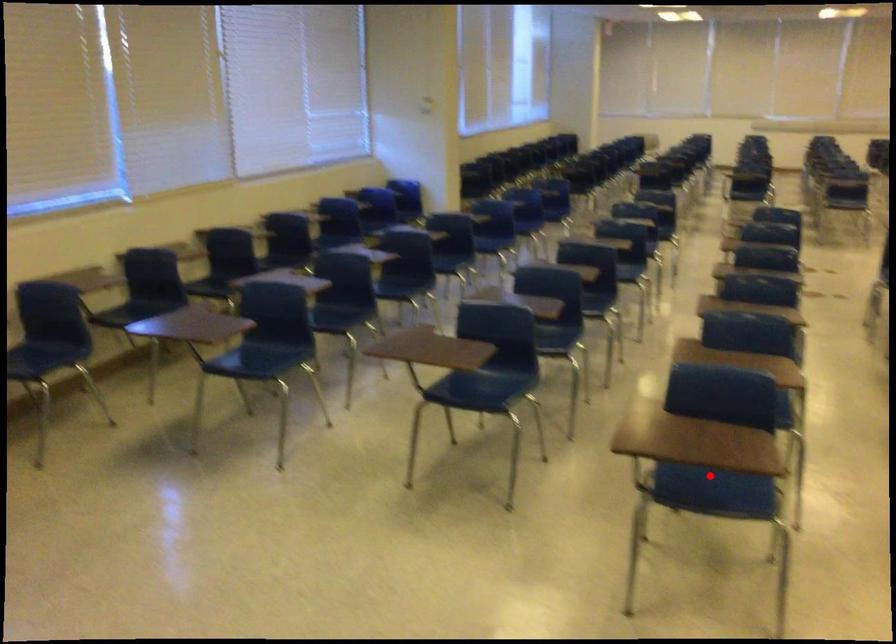
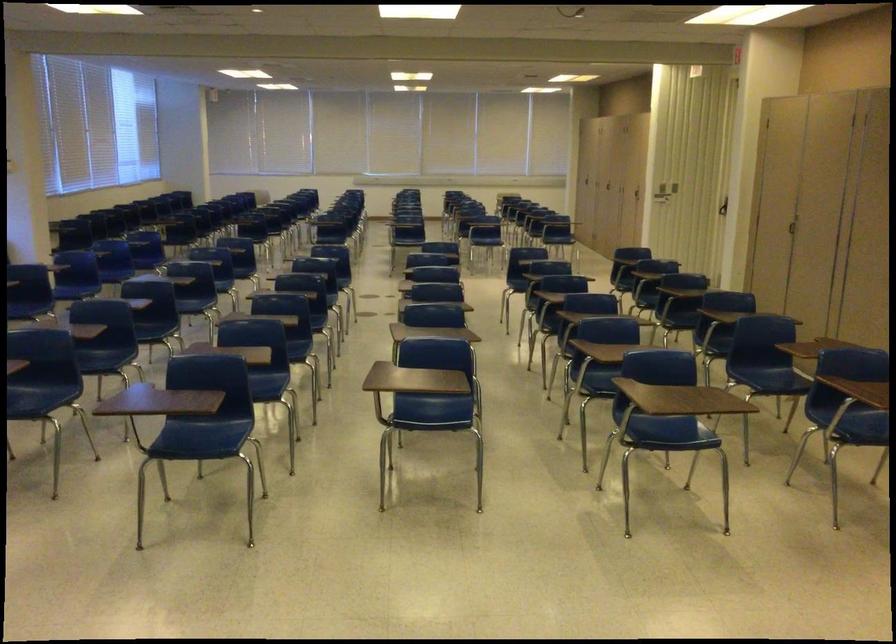
Question: I am providing you with two images of the same scene from different viewpoints. Given a red point in image1, look at the same physical point in image2. Is it:

Choices:
 (A) Closer to the viewpoint
 (B) Farther from the viewpoint

Answer: (B)